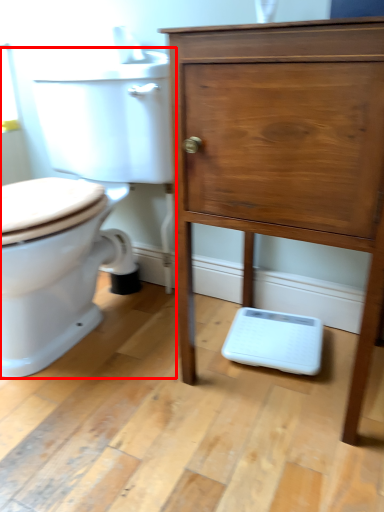
Question: From the image's perspective, what is the correct spatial positioning of toilet (annotated by the red box) in reference to chest of drawers?

Choices:
 (A) above
 (B) below

Answer: (A)